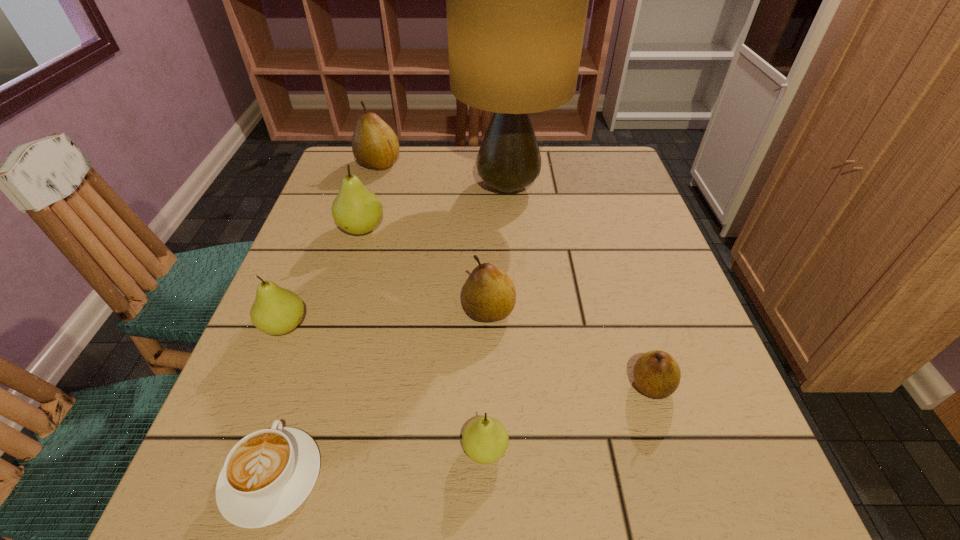
Locate an element on the screen. Image resolution: width=960 pixels, height=540 pixels. lampshade is located at coordinates (517, 0).

At what (x,y) coordinates should I click in order to perform the action: click on the tallest object. Please return your answer as a coordinate pair (x, y). This screenshot has width=960, height=540. Looking at the image, I should click on (517, 0).

At what (x,y) coordinates should I click in order to perform the action: click on the farthest pear. Please return your answer as a coordinate pair (x, y). This screenshot has height=540, width=960. Looking at the image, I should click on (375, 145).

Where is `the biggest brown pear`? This screenshot has height=540, width=960. the biggest brown pear is located at coordinates pos(375,145).

In order to click on the farthest green pear in this screenshot , I will do `click(356, 210)`.

Find the location of `the biggest green pear`. the biggest green pear is located at coordinates (356, 210).

The height and width of the screenshot is (540, 960). I want to click on the second smallest green pear, so click(x=276, y=311).

This screenshot has height=540, width=960. Identify the location of the second brown pear from left to right. (489, 294).

Find the location of a particular element. The image size is (960, 540). the second smallest brown pear is located at coordinates (489, 294).

This screenshot has height=540, width=960. Identify the location of the nearest pear. (485, 440).